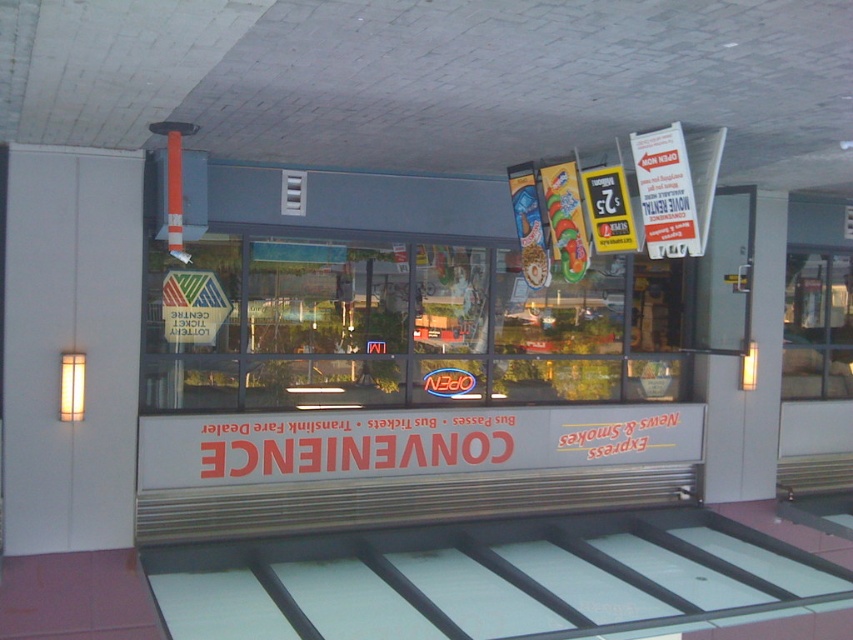
You are a customer looking at the convenience store facade. You notice two signs, the white paper sign at upper right and the yellow paper sign at center. Which one is bigger?

The white paper sign at upper right is larger in size compared to the yellow paper sign at center.

You are a customer standing in front of the convenience store. You notice two paper signs on the storefront. One is the white paper sign at upper right and the other is the yellow paper sign at center. Which sign is taller?

The white paper sign at upper right is taller than the yellow paper sign at center.